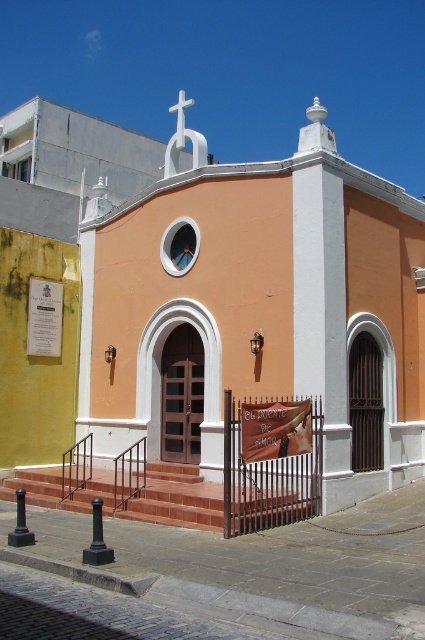
Which is above, matte orange church at center or terracotta brick stairs at center?

matte orange church at center

Which is more to the left, matte orange church at center or terracotta brick stairs at center?

terracotta brick stairs at center

I want to click on matte orange church at center, so click(215, 326).

The image size is (425, 640). Identify the location of matte orange church at center. (215, 326).